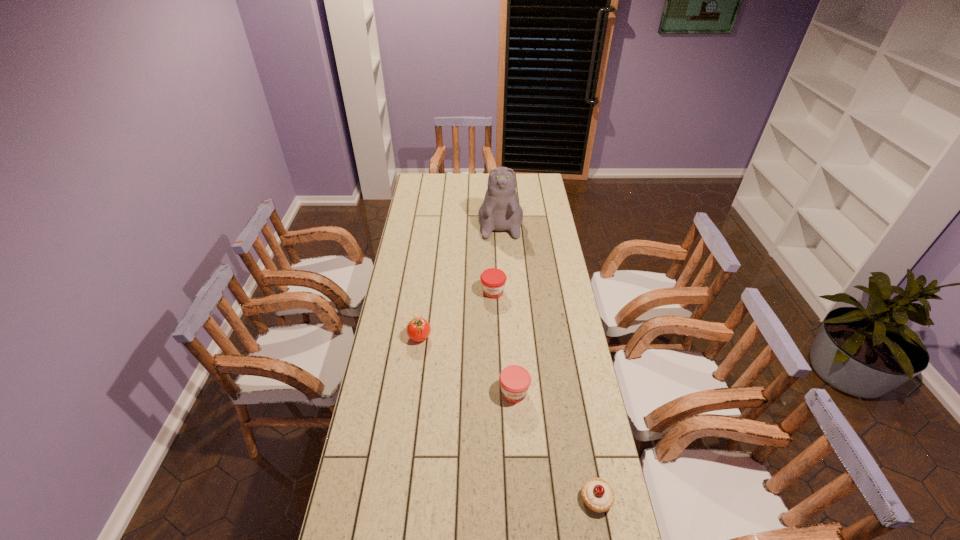
I want to click on empty space between the tallest object and the leftmost object, so click(460, 277).

The width and height of the screenshot is (960, 540). In order to click on free space between the farther jam and the farthest object in this screenshot , I will do `click(496, 254)`.

Identify the location of blank region between the fourth nearest object and the nearer jam. (504, 342).

Locate an element on the screen. This screenshot has width=960, height=540. vacant area that lies between the leftmost object and the farther jam is located at coordinates (456, 314).

Find the location of a particular element. The image size is (960, 540). free space between the tallest object and the nearer jam is located at coordinates (507, 305).

What are the coordinates of `vacant area that lies between the fourth farthest object and the leftmost object` in the screenshot? It's located at (467, 364).

The height and width of the screenshot is (540, 960). I want to click on empty space that is in between the farther jam and the tomato, so click(456, 314).

Find the location of a particular element. vacant region between the farthest object and the farther jam is located at coordinates (496, 254).

The height and width of the screenshot is (540, 960). In order to click on unoccupied position between the leftmost object and the shortest object in this screenshot , I will do `click(508, 417)`.

Identify which object is the fourth nearest to the nearest object. Please provide its 2D coordinates. Your answer should be formatted as a tuple, i.e. [(x, y)], where the tuple contains the x and y coordinates of a point satisfying the conditions above.

[(500, 210)]